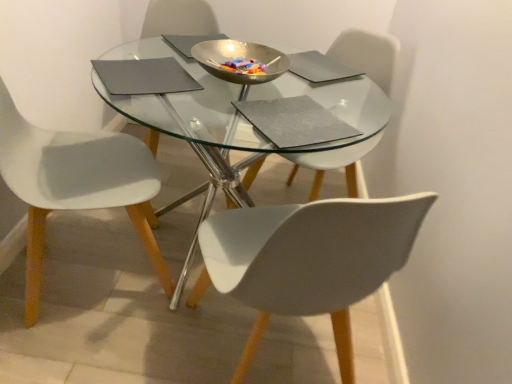
Find the location of `free space that is in between white plastic chair at lower right, the 2th chair viewed from the left, and transparent glass table at center`. free space that is in between white plastic chair at lower right, the 2th chair viewed from the left, and transparent glass table at center is located at coordinates (145, 358).